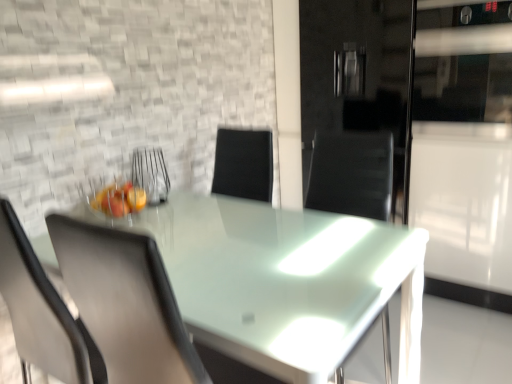
Describe the element at coordinates (126, 303) in the screenshot. I see `matte gray chair at left` at that location.

The width and height of the screenshot is (512, 384). In order to click on transparent glass table at center in this screenshot , I will do `click(284, 280)`.

In order to face metallic wire basket at center, should I rotate leftwards or rightwards?

Turn left by 14.217 degrees to look at metallic wire basket at center.

The image size is (512, 384). I want to click on matte gray chair at left, so click(126, 303).

Which object is closer to the camera taking this photo, transparent glass table at center or metallic wire basket at center?

transparent glass table at center is closer to the camera.

Are transparent glass table at center and metallic wire basket at center far apart?

They are positioned close to each other.

Which of these two, transparent glass table at center or metallic wire basket at center, is wider?

transparent glass table at center is wider.

Is matte gray chair at left further to camera compared to metallic wire basket at center?

No, it is in front of metallic wire basket at center.

From the image's perspective, is matte gray chair at left positioned above or below metallic wire basket at center?

matte gray chair at left is situated lower than metallic wire basket at center in the image.

Between matte gray chair at left and metallic wire basket at center, which one has larger width?

matte gray chair at left is wider.

From the picture: Does matte gray chair at left have a larger size compared to metallic wire basket at center?

Indeed, matte gray chair at left has a larger size compared to metallic wire basket at center.

Looking at this image, considering the relative sizes of matte gray chair at left and transparent glass table at center in the image provided, is matte gray chair at left thinner than transparent glass table at center?

Yes, matte gray chair at left is thinner than transparent glass table at center.

Is transparent glass table at center completely or partially inside matte gray chair at left?

No, transparent glass table at center is located outside of matte gray chair at left.

Which is behind, point (134, 183) or point (304, 320)?

Point (134, 183)

Does metallic wire basket at center come behind transparent glass table at center?

Yes, the depth of metallic wire basket at center is greater than that of transparent glass table at center.

Is metallic wire basket at center taller or shorter than transparent glass table at center?

In the image, metallic wire basket at center appears to be shorter than transparent glass table at center.

Is metallic wire basket at center facing towards transparent glass table at center?

→ No, metallic wire basket at center is not oriented towards transparent glass table at center.

At what (x,y) coordinates should I click in order to perform the action: click on table lying in front of the matte gray chair at left. Please return your answer as a coordinate pair (x, y). This screenshot has width=512, height=384. Looking at the image, I should click on [284, 280].

Considering the relative sizes of transparent glass table at center and matte gray chair at left in the image provided, is transparent glass table at center thinner than matte gray chair at left?

No, transparent glass table at center is not thinner than matte gray chair at left.

Which object is positioned more to the left, transparent glass table at center or matte gray chair at left?

From the viewer's perspective, matte gray chair at left appears more on the left side.

Which object is more forward, transparent glass table at center or matte gray chair at left?

transparent glass table at center is in front.

Is metallic wire basket at center taller than matte gray chair at left?

In fact, metallic wire basket at center may be shorter than matte gray chair at left.

Is metallic wire basket at center not within matte gray chair at left?

That's correct, metallic wire basket at center is outside of matte gray chair at left.

Is matte gray chair at left at the back of metallic wire basket at center?

No.

Can you confirm if metallic wire basket at center is wider than matte gray chair at left?

No.

This screenshot has height=384, width=512. What are the coordinates of `table to the right of metallic wire basket at center` in the screenshot? It's located at (284, 280).

Image resolution: width=512 pixels, height=384 pixels. I want to click on armchair that appears above the matte gray chair at left (from the image's perspective), so click(x=150, y=174).

Which object lies nearer to the anchor point matte gray chair at left, transparent glass table at center or metallic wire basket at center?

The object closer to matte gray chair at left is transparent glass table at center.

Which object lies nearer to the anchor point matte gray chair at left, metallic wire basket at center or transparent glass table at center?

The object closer to matte gray chair at left is transparent glass table at center.

From the image, which object appears to be farther from metallic wire basket at center, transparent glass table at center or matte gray chair at left?

Among the two, matte gray chair at left is located further to metallic wire basket at center.

Which object lies nearer to the anchor point metallic wire basket at center, matte gray chair at left or transparent glass table at center?

Based on the image, transparent glass table at center appears to be nearer to metallic wire basket at center.

In the scene shown: From the image, which object appears to be farther from transparent glass table at center, metallic wire basket at center or matte gray chair at left?

metallic wire basket at center is positioned further to the anchor transparent glass table at center.

From the image, which object appears to be nearer to transparent glass table at center, matte gray chair at left or metallic wire basket at center?

matte gray chair at left lies closer to transparent glass table at center than the other object.

Identify the location of chair positioned between transparent glass table at center and metallic wire basket at center from near to far. This screenshot has height=384, width=512. (126, 303).